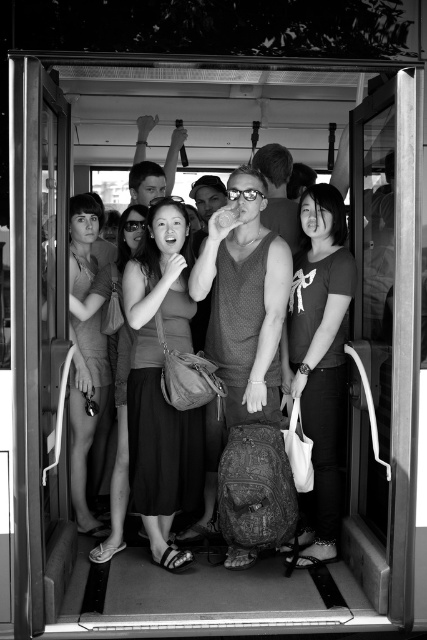
Who is lower down, matte gray dress at center or matte fabric dress at left?

Positioned lower is matte gray dress at center.

Is point (163, 529) more distant than point (75, 282)?

That is False.

Locate an element on the screen. Image resolution: width=427 pixels, height=640 pixels. matte gray dress at center is located at coordinates (160, 381).

Can you confirm if black matte t-shirt at center is bigger than matte fabric dress at left?

Indeed, black matte t-shirt at center has a larger size compared to matte fabric dress at left.

Does black matte t-shirt at center appear on the left side of matte fabric dress at left?

No, black matte t-shirt at center is not to the left of matte fabric dress at left.

Is point (280, 353) more distant than point (76, 275)?

No.

You are a GUI agent. You are given a task and a screenshot of the screen. Output one action in this format:
    pyautogui.click(x=<x>, y=<y>)
    Task: Click on the black matte t-shirt at center
    Image resolution: width=427 pixels, height=640 pixels.
    Given the screenshot: What is the action you would take?
    pyautogui.click(x=319, y=360)

Which is behind, point (160, 465) or point (286, 321)?

Point (286, 321)

Is matte gray dress at center further to the viewer compared to black matte t-shirt at center?

No, matte gray dress at center is closer to the viewer.

Which is behind, point (164, 252) or point (301, 198)?

Positioned behind is point (301, 198).

At what (x,y) coordinates should I click in order to perform the action: click on matte gray dress at center. Please return your answer as a coordinate pair (x, y). Looking at the image, I should click on (160, 381).